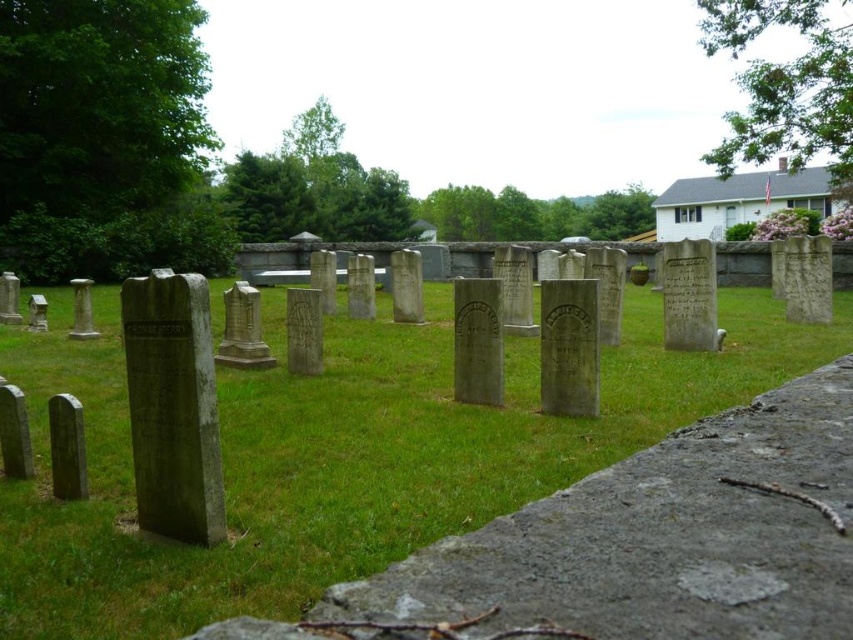
Who is shorter, green grass at center or gray stone gravestone at left?

gray stone gravestone at left is shorter.

You are a GUI agent. You are given a task and a screenshot of the screen. Output one action in this format:
    pyautogui.click(x=<x>, y=<y>)
    Task: Click on the green grass at center
    The width and height of the screenshot is (853, 640).
    Given the screenshot: What is the action you would take?
    pos(340,456)

Between point (376, 499) and point (166, 416), which one is positioned in front?

Positioned in front is point (166, 416).

At what (x,y) coordinates should I click in order to perform the action: click on green grass at center. Please return your answer as a coordinate pair (x, y). Looking at the image, I should click on (340, 456).

Describe the element at coordinates (340, 456) in the screenshot. I see `green grass at center` at that location.

Is green grass at center shorter than smooth gray stone at lower left?

Incorrect, green grass at center's height does not fall short of smooth gray stone at lower left's.

Who is more distant from viewer, (416, 406) or (57, 480)?

Positioned behind is point (416, 406).

The width and height of the screenshot is (853, 640). I want to click on green grass at center, so click(340, 456).

Does green grass at center have a larger size compared to smooth gray stone gravestone at left?

Yes, green grass at center is bigger than smooth gray stone gravestone at left.

What do you see at coordinates (340, 456) in the screenshot? I see `green grass at center` at bounding box center [340, 456].

Is point (674, 388) less distant than point (44, 296)?

Yes, point (674, 388) is closer to viewer.

Locate an element on the screen. This screenshot has width=853, height=640. green grass at center is located at coordinates (340, 456).